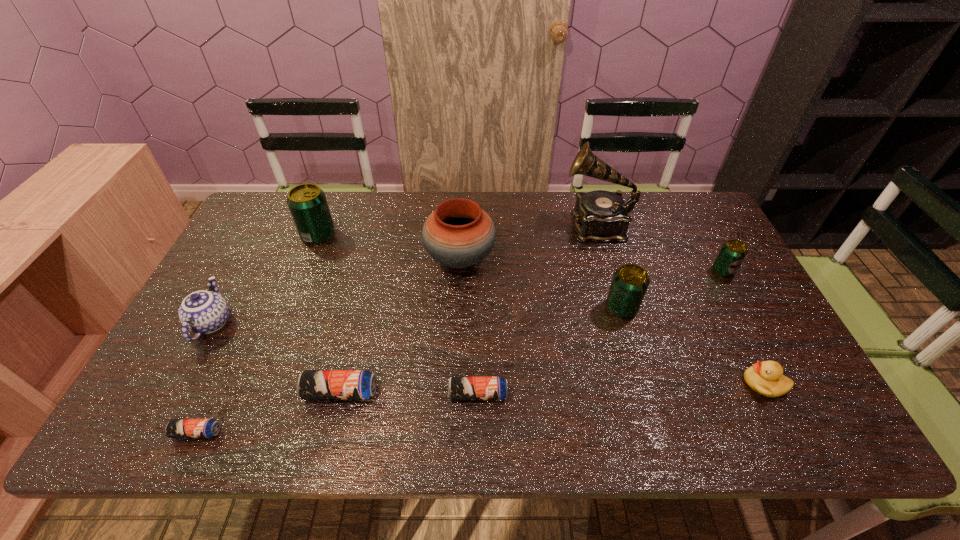
Where is `vacant space at the far edge`? The width and height of the screenshot is (960, 540). vacant space at the far edge is located at coordinates (346, 202).

The height and width of the screenshot is (540, 960). What are the coordinates of `free point at the near edge` in the screenshot? It's located at (282, 414).

In the image, there is a desktop. At what (x,y) coordinates should I click in order to perform the action: click on free space at the left edge. Please return your answer as a coordinate pair (x, y). Looking at the image, I should click on coord(249,266).

Locate an element on the screen. Image resolution: width=960 pixels, height=540 pixels. vacant area at the right edge is located at coordinates (710, 295).

Image resolution: width=960 pixels, height=540 pixels. Identify the location of free region at the far left corner of the desktop. (284, 237).

Identify the location of vacant space at the far right corner of the desktop. (689, 203).

Where is `vacant area that lies between the fourth beer can from left to right and the pottery`? vacant area that lies between the fourth beer can from left to right and the pottery is located at coordinates (469, 326).

Find the location of a particular element. The image size is (960, 540). free space between the second beer can from right to left and the tallest object is located at coordinates (609, 267).

You are a GUI agent. You are given a task and a screenshot of the screen. Output one action in this format:
    pyautogui.click(x=<x>, y=<y>)
    Task: Click on the free space between the leftmost green beer can and the smallest green beer can
    
    Given the screenshot: What is the action you would take?
    pyautogui.click(x=520, y=253)

The width and height of the screenshot is (960, 540). Identify the location of free space between the red pottery and the smallest green beer can. (591, 265).